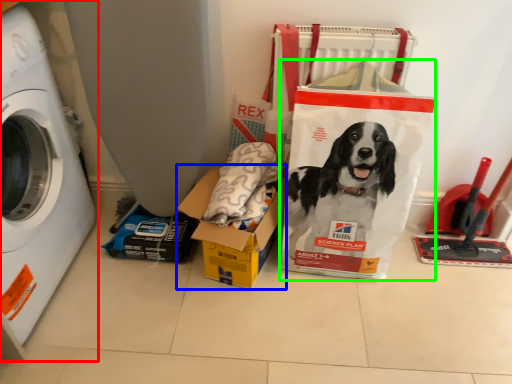
Question: Which is nearer to the washing machine (highlighted by a red box)? box (highlighted by a blue box) or paper bag (highlighted by a green box).

Choices:
 (A) box
 (B) paper bag

Answer: (A)